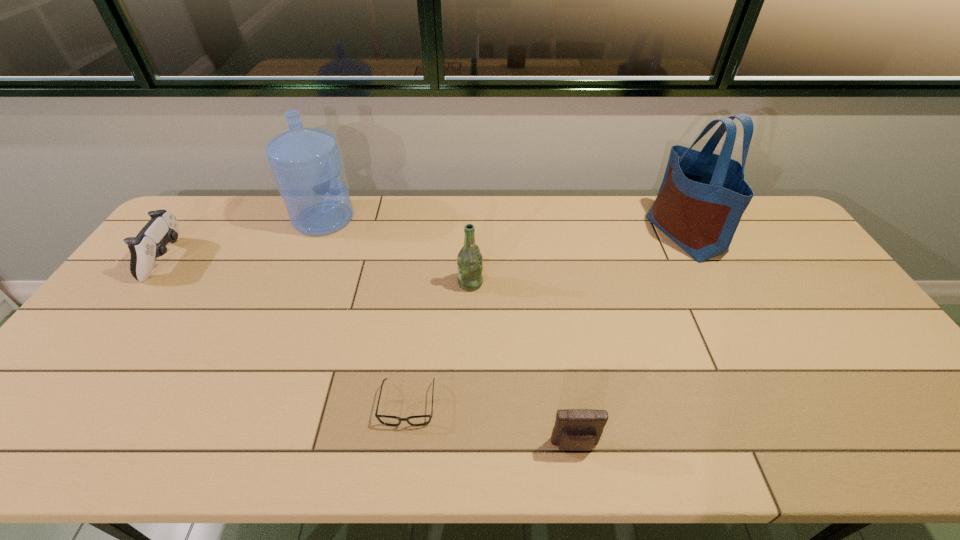
Find the location of `free region that satisfies the following two spatial constraints: 1. on the front side of the rightmost object; 2. on the front-facing side of the control`. free region that satisfies the following two spatial constraints: 1. on the front side of the rightmost object; 2. on the front-facing side of the control is located at coordinates (698, 259).